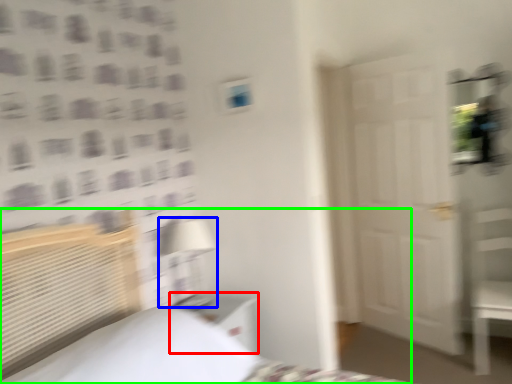
Question: Estimate the real-world distances between objects in this image. Which object is closer to nightstand (highlighted by a red box), table lamp (highlighted by a blue box) or bed (highlighted by a green box)?

Choices:
 (A) table lamp
 (B) bed

Answer: (A)